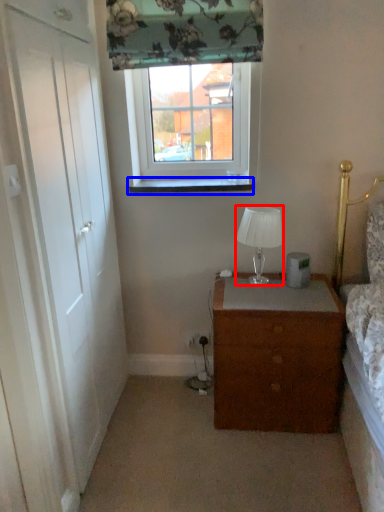
Question: Which point is closer to the camera, lamp (highlighted by a red box) or window sill (highlighted by a blue box)?

Choices:
 (A) lamp
 (B) window sill

Answer: (A)